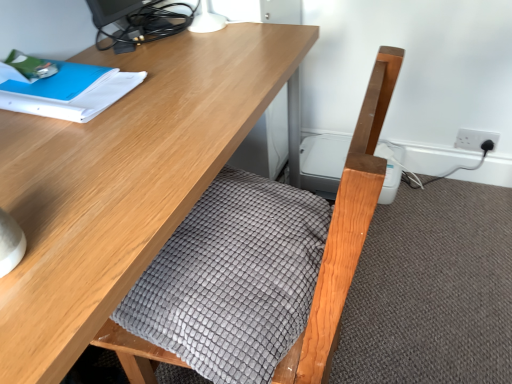
Where is `vacant point above wooden desk at center (from a real-world perspective)`? This screenshot has width=512, height=384. vacant point above wooden desk at center (from a real-world perspective) is located at coordinates (131, 100).